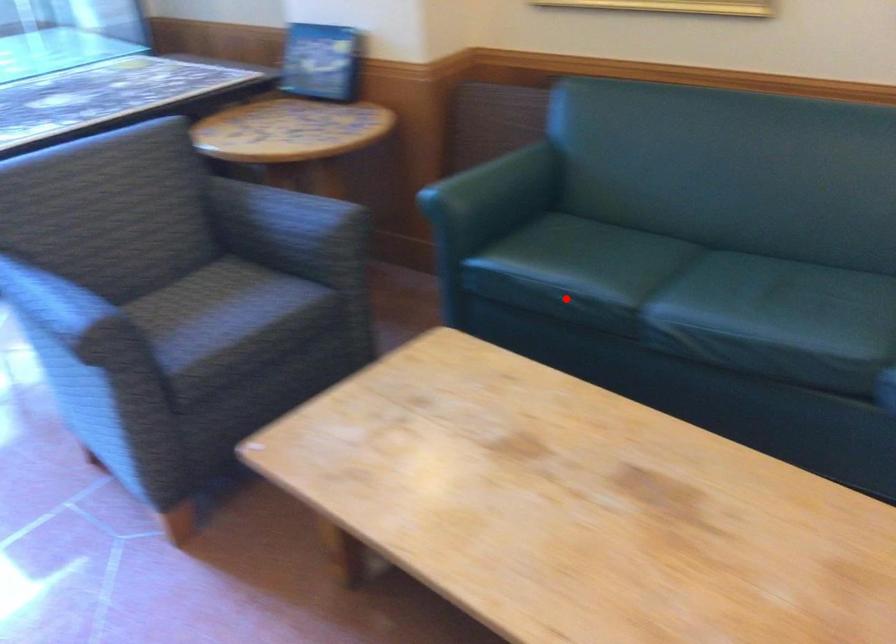
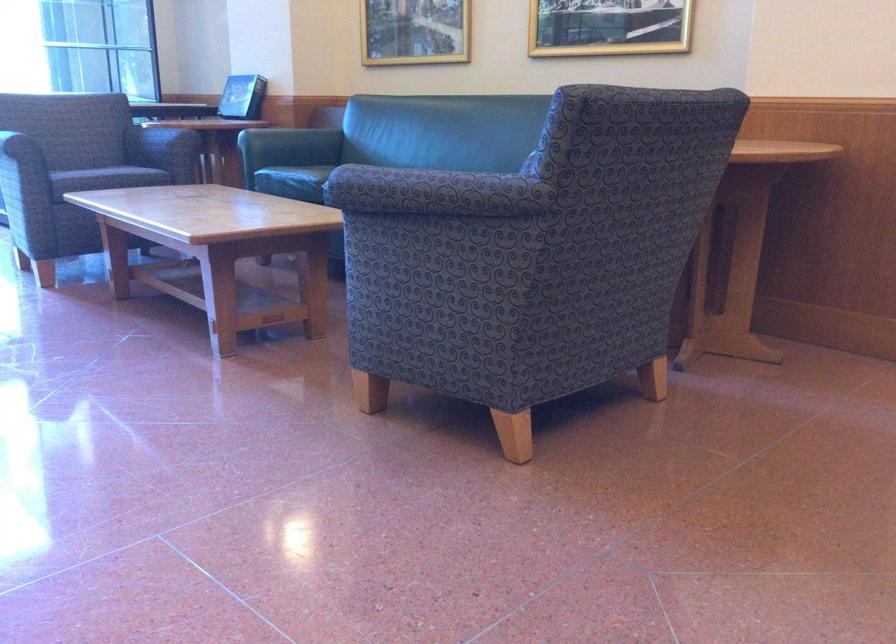
Question: I am providing you with two images of the same scene from different viewpoints. Image1 has a red point marked. In image2, the corresponding 3D location appears at what relative position? Reply with the corresponding letter.

Choices:
 (A) Closer
 (B) Farther

Answer: (B)